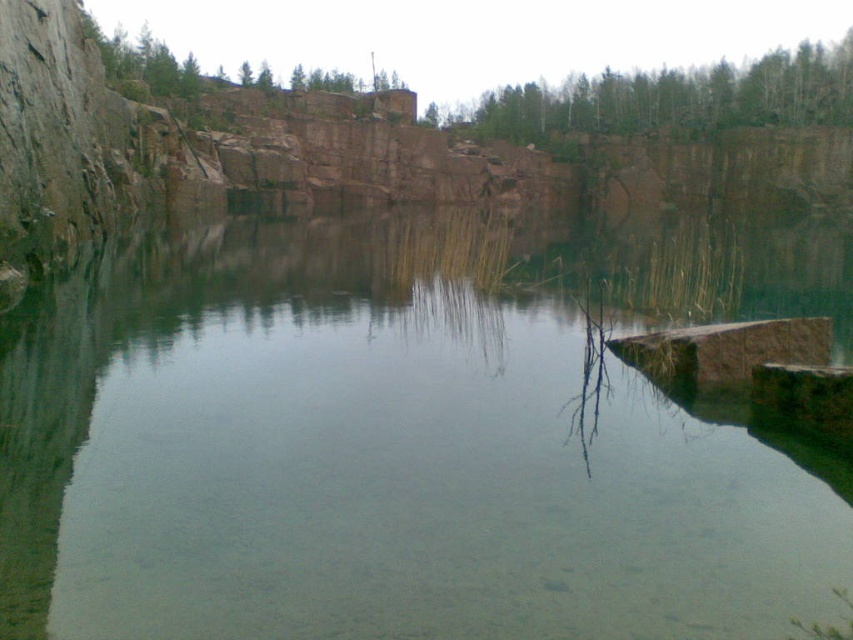
Question: Which point is farther to the camera?

Choices:
 (A) (486, 102)
 (B) (520, 333)

Answer: (A)

Question: Considering the relative positions of clear water at center and green leafy trees at upper center in the image provided, where is clear water at center located with respect to green leafy trees at upper center?

Choices:
 (A) below
 (B) above

Answer: (A)

Question: Is clear water at center to the left of green leafy trees at upper center from the viewer's perspective?

Choices:
 (A) yes
 (B) no

Answer: (A)

Question: Does clear water at center appear on the left side of green leafy trees at upper center?

Choices:
 (A) no
 (B) yes

Answer: (B)

Question: Which point appears farthest from the camera in this image?

Choices:
 (A) (766, 250)
 (B) (662, 125)

Answer: (B)

Question: Which of the following is the farthest from the observer?

Choices:
 (A) (648, 390)
 (B) (728, 84)

Answer: (B)